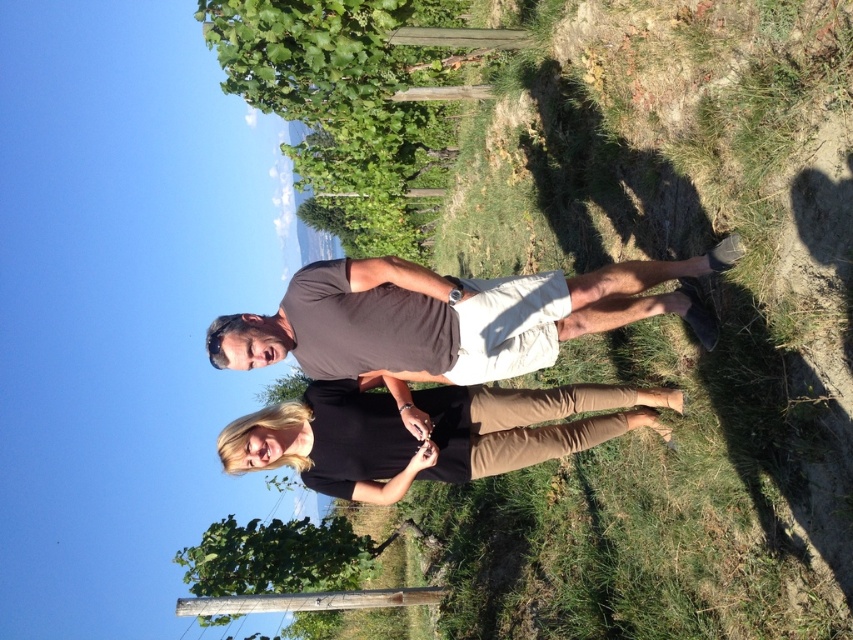
What do you see at coordinates (445, 316) in the screenshot? I see `matte brown t-shirt at center` at bounding box center [445, 316].

What do you see at coordinates (445, 316) in the screenshot?
I see `matte brown t-shirt at center` at bounding box center [445, 316].

This screenshot has height=640, width=853. I want to click on matte brown t-shirt at center, so click(445, 316).